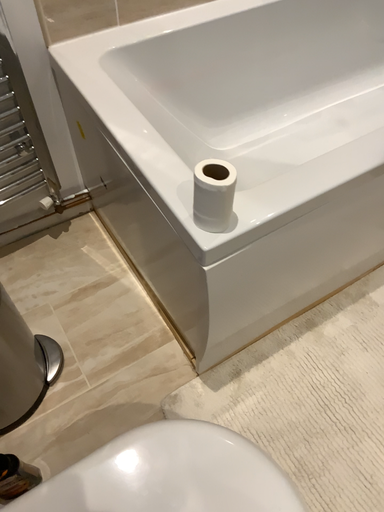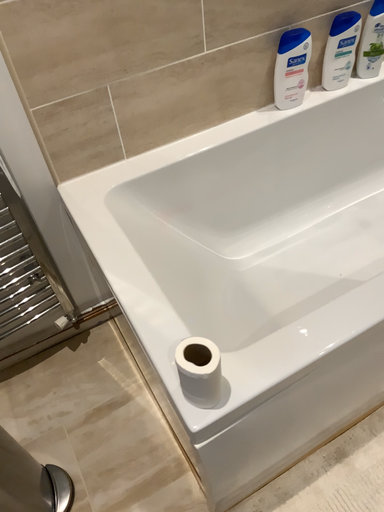
Question: Which way did the camera rotate in the video?

Choices:
 (A) rotated right
 (B) rotated left

Answer: (B)